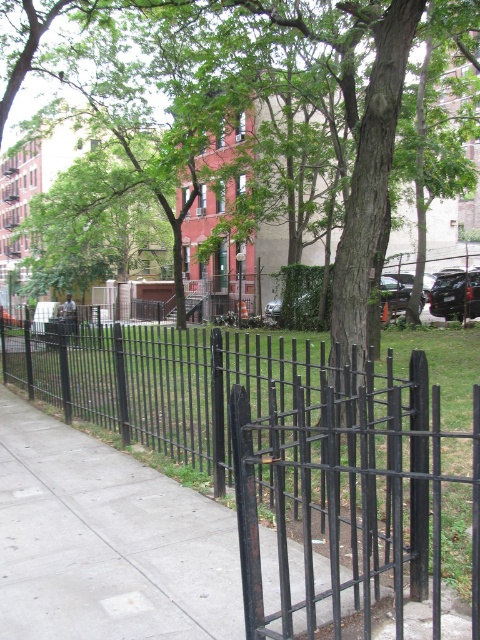
Can you confirm if black metal fence at center is positioned below green leafy tree at center?

Yes, black metal fence at center is below green leafy tree at center.

Describe the element at coordinates (274, 445) in the screenshot. The height and width of the screenshot is (640, 480). I see `black metal fence at center` at that location.

Who is more distant from viewer, [267,456] or [385,163]?

Point [385,163]

I want to click on black metal fence at center, so click(x=274, y=445).